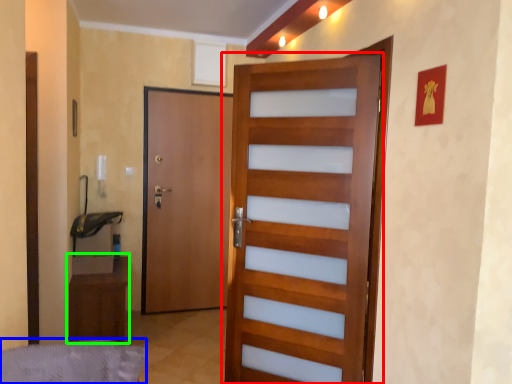
Question: Which is nearer to the door (highlighted by a red box)? bed frame (highlighted by a blue box) or furniture (highlighted by a green box).

Choices:
 (A) bed frame
 (B) furniture

Answer: (A)